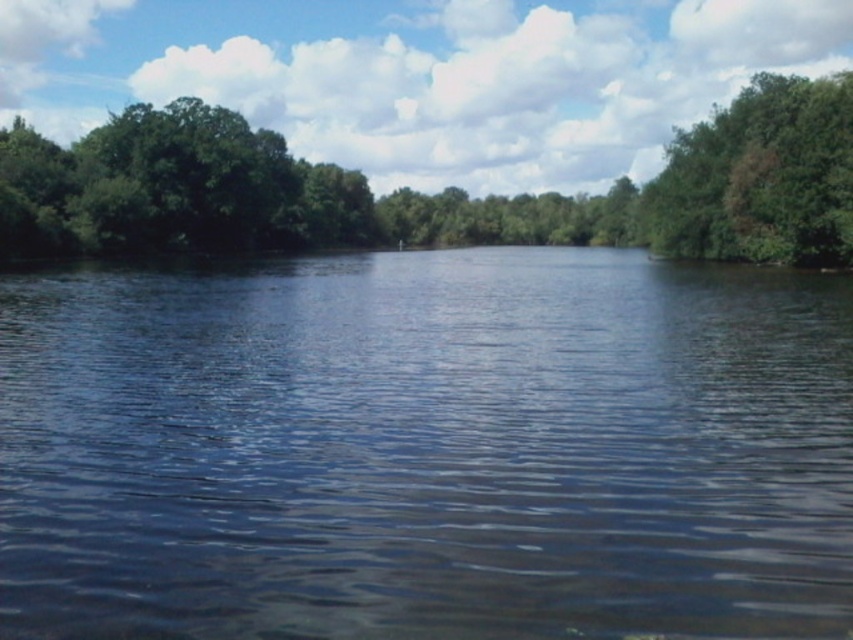
You are standing at the center of the image and see the point labeled as point (437,193). Which direction should you face to look towards the green leafy trees at left?

The point labeled point (437,193) is located on the green leafy trees at left, so you should face towards the left to look towards the green leafy trees at left.

You are standing at the edge of the water and want to take a photo of the green leafy tree at upper right. Since the transparent water at center is between you and the tree, will the tree appear partially reflected in the water in your photo?

The transparent water at center is in front of green leafy tree at upper right, so the tree will appear reflected in the water in your photo because the water is between you and the tree, creating a reflective surface.